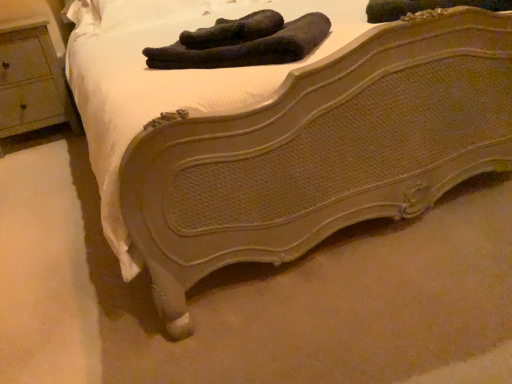
Question: Is black fuzzy socks at center, placed as the second footwear when sorted from left to right, in front of or behind wooden nightstand at left in the image?

Choices:
 (A) front
 (B) behind

Answer: (A)

Question: Is point (241, 64) closer or farther from the camera than point (10, 87)?

Choices:
 (A) farther
 (B) closer

Answer: (B)

Question: Estimate the real-world distances between objects in this image. Which object is closer to the dark green fabric socks at upper center, which is the second footwear from right to left?

Choices:
 (A) black fuzzy socks at center, placed as the second footwear when sorted from left to right
 (B) wooden nightstand at left

Answer: (A)

Question: Estimate the real-world distances between objects in this image. Which object is closer to the black fuzzy socks at center, the first footwear when ordered from right to left?

Choices:
 (A) wooden nightstand at left
 (B) dark green fabric socks at upper center, which is the second footwear from right to left

Answer: (B)